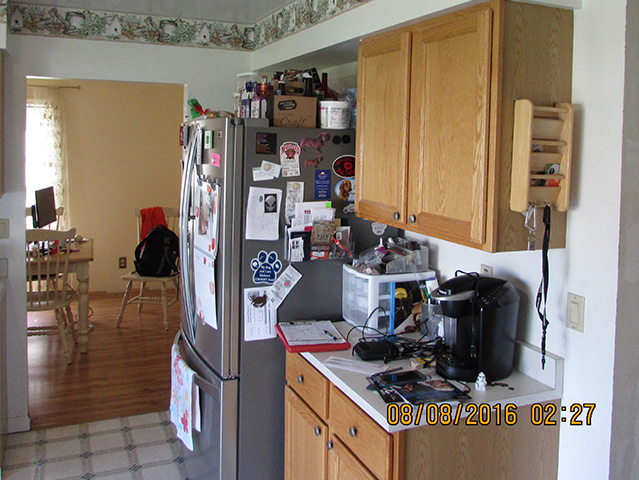
Where is `coffee maker`? The width and height of the screenshot is (639, 480). coffee maker is located at coordinates (500, 330).